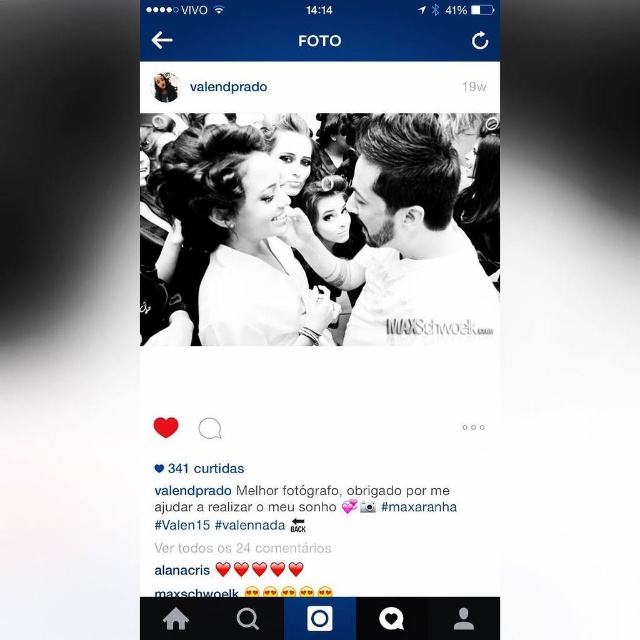
You are designing a layout for a magazine cover and need to place a dress image and a text block. The dress image is the white matte dress at center and the text block is the white matte text at center. The magazine has a strict rule that the dress and text must be at least 20 inches apart. Based on the Instagram photo provided, will their current spacing meet the magazine requirement?

The white matte dress at center and white matte text at center are 15.94 inches apart from each other, which is less than the required 20 inches. Therefore, their current spacing does not meet the magazine requirement.

In the Instagram photo, there is a white matte dress at center and a matte white hair at center. Which one is positioned to the right side?

The white matte dress at center is to the right of the matte white hair at center.

You are at a social event and want to take a photo of the two people at the coordinates point (362, 216) and point (388, 508). Which of these two people is positioned further away from you?

The person at point (362, 216) is positioned further away from you because the Objects Description states that point (362, 216) is behind point (388, 508).